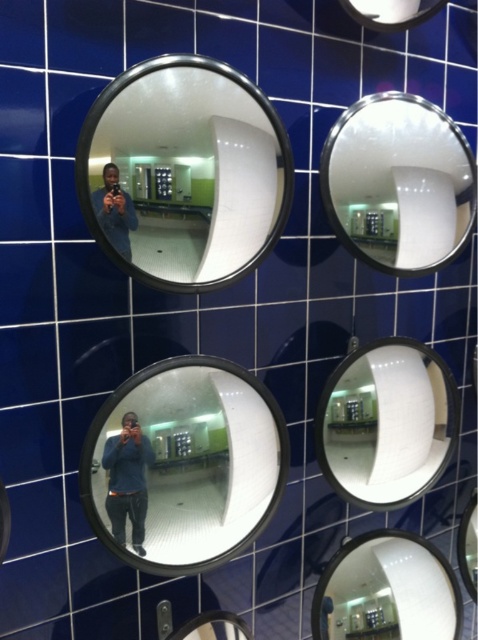
You are an interior designer planning to install two mirrors in a client bathroom. The client wants to know if the clear glass mirror at center right will fit above the sink where the metallic silver mirror at lower center is currently placed. Can you confirm if it will fit?

The clear glass mirror at center right is larger in size than the metallic silver mirror at lower center. Therefore, it will not fit in the space currently occupied by the metallic silver mirror at lower center.

You are standing in front of the wall with dark blue tiles and need to locate the clear glass mirror at center. According to the coordinates provided, where exactly is it positioned?

The clear glass mirror at center is located at point 0.727 on the x axis and 0.387 on the y axis.

You are standing in front of the wall with dark blue tiles and want to place a new mirror exactly where the clear glass mirror at center right is currently located. What are the coordinates of the spot where you should place the new mirror?

The coordinates for placing the new mirror should be at point (387, 422), as that is the 2D location of the clear glass mirror at center right.